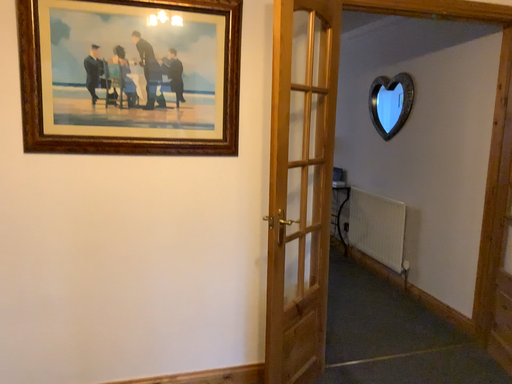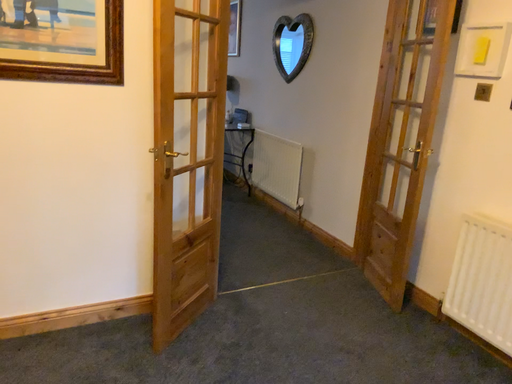
Question: Which way did the camera rotate in the video?

Choices:
 (A) rotated left
 (B) rotated right

Answer: (B)